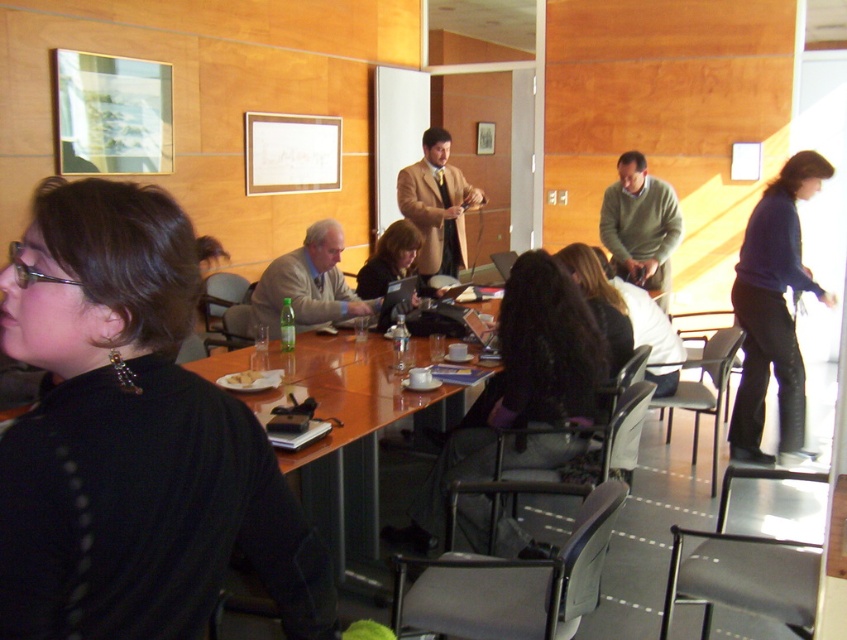
You are a service robot with a width of 1.5 meters. You need to move from the black matte sweater at left to the black fabric jacket at center. Can you pass through the space between them without moving any objects?

The distance between the black matte sweater at left and black fabric jacket at center is 1.90 meters. Since the robot is 1.5 meters wide, it can pass through the space as the distance is wider than the robot.

You are a photographer positioned at the back of the conference room. You want to take a photo of both the black matte sweater at left and the black fabric jacket at center. Which object will appear larger in your photo?

The black matte sweater at left will appear larger in the photo because it is closer to the viewer than the black fabric jacket at center.